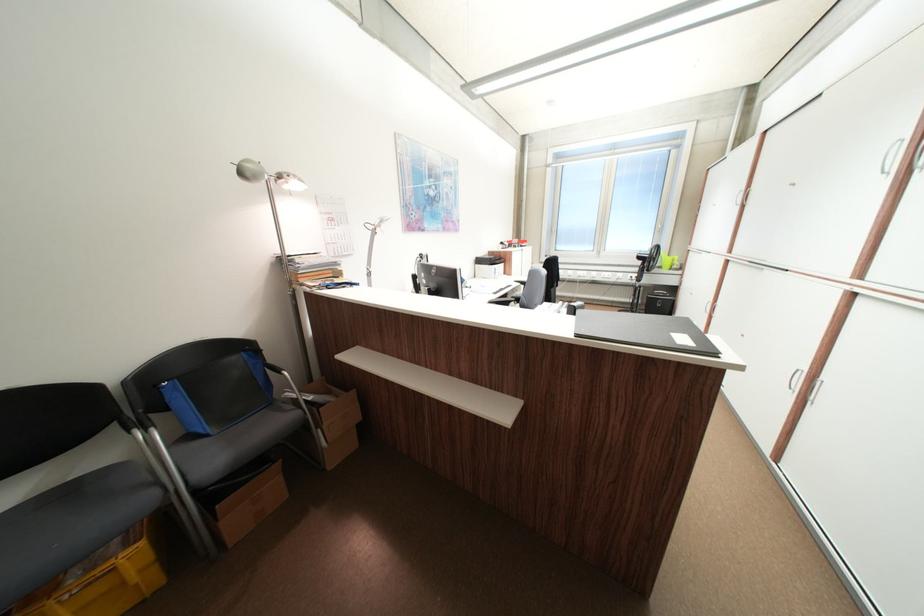
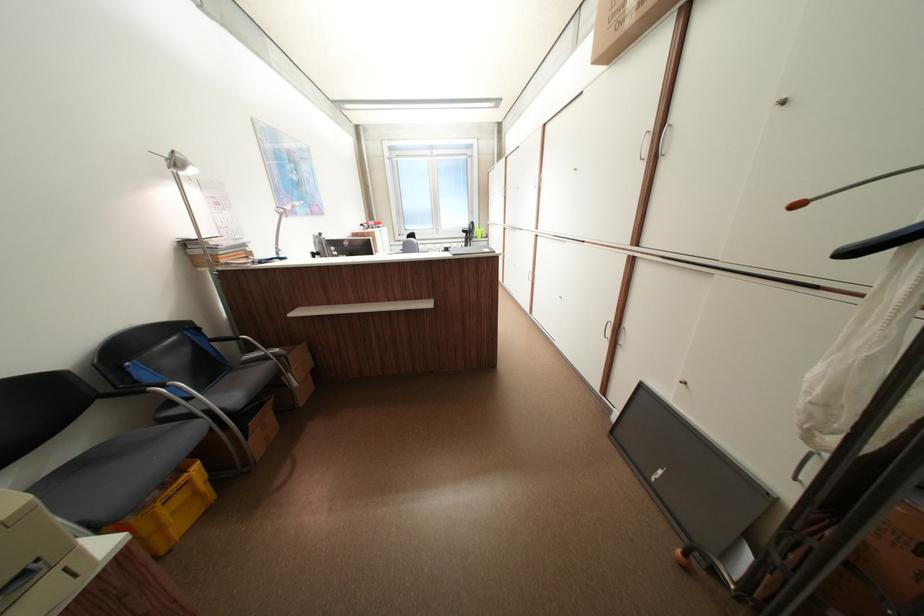
Where in the second image is the point corresponding to point (327, 426) from the first image?

(297, 371)